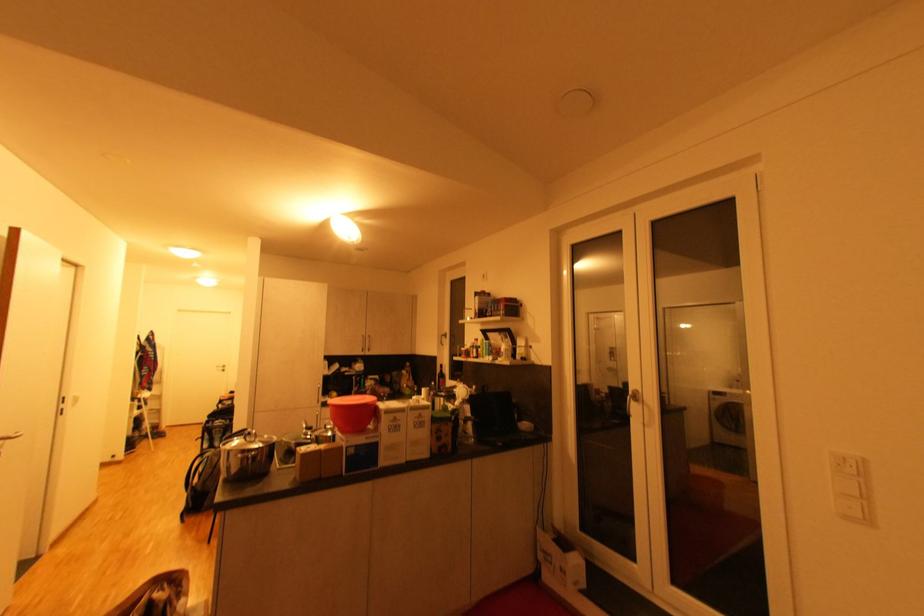
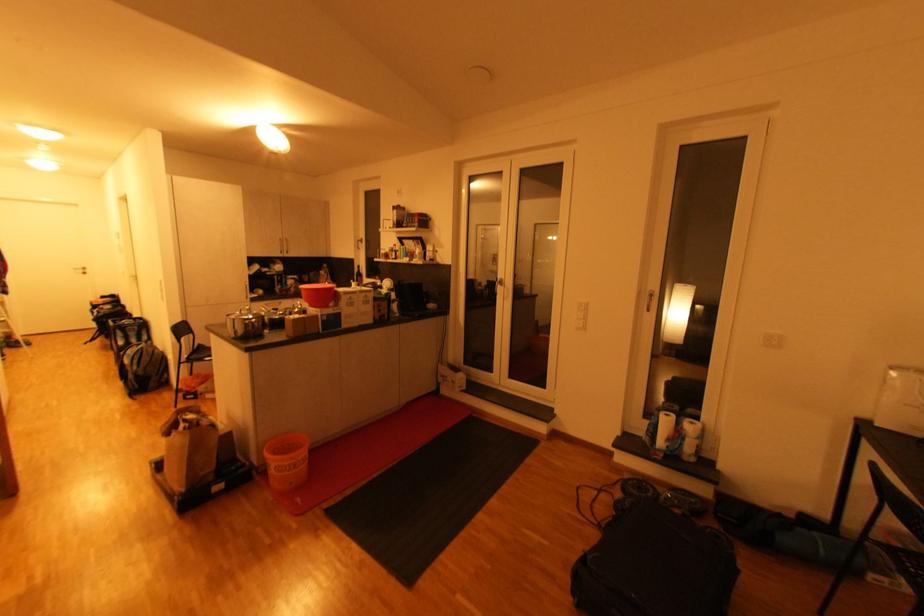
Find the pixel in the second image that matches the point at 444,376 in the first image.

(361, 275)